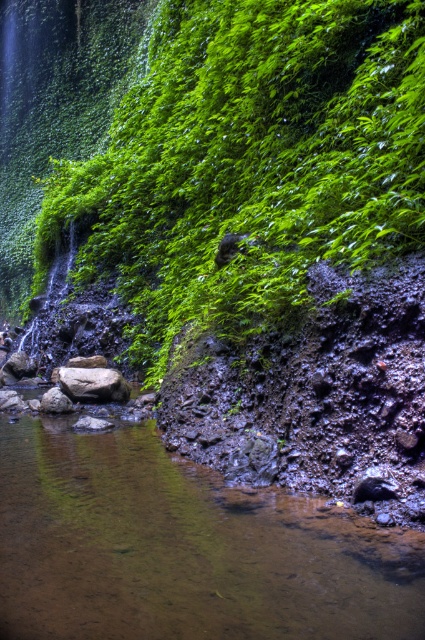
Question: Among these points, which one is farthest from the camera?

Choices:
 (A) (161, 492)
 (B) (421, 184)

Answer: (A)

Question: Is green leafy vegetation at left to the right of brown rough rock at center from the viewer's perspective?

Choices:
 (A) yes
 (B) no

Answer: (A)

Question: Which object is positioned closest to the brown rough rock at center?

Choices:
 (A) brown rock at lower left
 (B) green leafy vegetation at left

Answer: (B)

Question: Which object is the farthest from the green leafy vegetation at left?

Choices:
 (A) brown rough rock at center
 (B) brown rock at lower left

Answer: (B)

Question: In this image, where is green leafy vegetation at left located relative to brown rock at lower left?

Choices:
 (A) left
 (B) right

Answer: (A)

Question: Does green leafy vegetation at left lie behind brown rock at lower left?

Choices:
 (A) no
 (B) yes

Answer: (B)